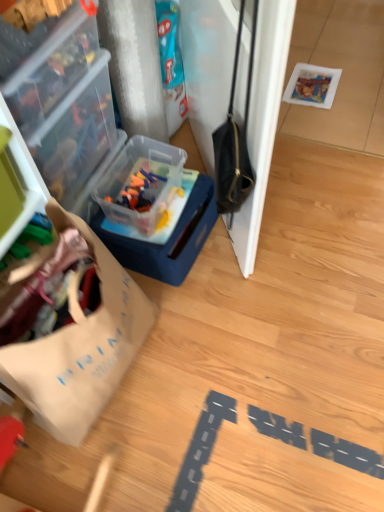
Question: Considering the relative positions of wooden floor at lower center and transparent plastic container at upper left, marked as the 1th box in a left-to-right arrangement, in the image provided, is wooden floor at lower center in front of transparent plastic container at upper left, marked as the 1th box in a left-to-right arrangement,?

Choices:
 (A) no
 (B) yes

Answer: (B)

Question: Is wooden floor at lower center far from transparent plastic container at upper left, marked as the 1th box in a left-to-right arrangement?

Choices:
 (A) no
 (B) yes

Answer: (A)

Question: Can you confirm if wooden floor at lower center is wider than transparent plastic container at upper left, marked as the 1th box in a left-to-right arrangement?

Choices:
 (A) yes
 (B) no

Answer: (A)

Question: From the image's perspective, would you say wooden floor at lower center is shown under transparent plastic container at upper left, acting as the second box starting from the right?

Choices:
 (A) no
 (B) yes

Answer: (B)

Question: Is wooden floor at lower center behind transparent plastic container at upper left, acting as the second box starting from the right?

Choices:
 (A) yes
 (B) no

Answer: (B)

Question: From a real-world perspective, relative to transparent plastic container at upper left, marked as the 1th box in a left-to-right arrangement, is translucent plastic container at center-left, the 2th box from the left, vertically above or below?

Choices:
 (A) above
 (B) below

Answer: (B)

Question: In terms of size, does translucent plastic container at center-left, the 2th box from the left, appear bigger or smaller than transparent plastic container at upper left, acting as the second box starting from the right?

Choices:
 (A) big
 (B) small

Answer: (B)

Question: Does point (198, 240) appear closer or farther from the camera than point (99, 146)?

Choices:
 (A) farther
 (B) closer

Answer: (A)

Question: Is translucent plastic container at center-left, which appears as the 1th box when viewed from the right, to the left or to the right of transparent plastic container at upper left, marked as the 1th box in a left-to-right arrangement, in the image?

Choices:
 (A) left
 (B) right

Answer: (B)

Question: Considering the relative positions of brown paper bag at left and translucent plastic container at center-left, which appears as the 1th box when viewed from the right, in the image provided, is brown paper bag at left to the left or to the right of translucent plastic container at center-left, which appears as the 1th box when viewed from the right,?

Choices:
 (A) right
 (B) left

Answer: (B)

Question: Is brown paper bag at left situated inside translucent plastic container at center-left, which appears as the 1th box when viewed from the right, or outside?

Choices:
 (A) outside
 (B) inside

Answer: (A)

Question: Is brown paper bag at left in front of or behind translucent plastic container at center-left, the 2th box from the left, in the image?

Choices:
 (A) front
 (B) behind

Answer: (A)

Question: Is brown paper bag at left taller or shorter than translucent plastic container at center-left, which appears as the 1th box when viewed from the right?

Choices:
 (A) tall
 (B) short

Answer: (A)

Question: Is point (82, 142) closer or farther from the camera than point (137, 216)?

Choices:
 (A) closer
 (B) farther

Answer: (A)

Question: In the image, is transparent plastic container at upper left, marked as the 1th box in a left-to-right arrangement, positioned in front of or behind translucent plastic container at center-left, the 2th box from the left?

Choices:
 (A) behind
 (B) front

Answer: (B)